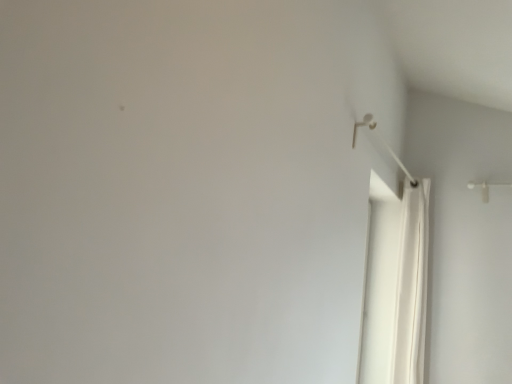
Question: Is white plastic shower at upper right positioned before white fabric shower curtain at right?

Choices:
 (A) no
 (B) yes

Answer: (B)

Question: From the image's perspective, does white plastic shower at upper right appear higher than white fabric shower curtain at right?

Choices:
 (A) no
 (B) yes

Answer: (B)

Question: From a real-world perspective, is white plastic shower at upper right under white fabric shower curtain at right?

Choices:
 (A) no
 (B) yes

Answer: (A)

Question: Is white plastic shower at upper right at the right side of white fabric shower curtain at right?

Choices:
 (A) yes
 (B) no

Answer: (B)

Question: Is white plastic shower at upper right aimed at white fabric shower curtain at right?

Choices:
 (A) no
 (B) yes

Answer: (A)

Question: Is white plastic shower at upper right directly adjacent to white fabric shower curtain at right?

Choices:
 (A) yes
 (B) no

Answer: (B)

Question: From the image's perspective, is white fabric shower curtain at right on top of white plastic shower at upper right?

Choices:
 (A) yes
 (B) no

Answer: (B)

Question: Can you confirm if white fabric shower curtain at right is taller than white plastic shower at upper right?

Choices:
 (A) no
 (B) yes

Answer: (B)

Question: Can you confirm if white fabric shower curtain at right is smaller than white plastic shower at upper right?

Choices:
 (A) yes
 (B) no

Answer: (B)

Question: Is white fabric shower curtain at right surrounding white plastic shower at upper right?

Choices:
 (A) no
 (B) yes

Answer: (A)

Question: Can you confirm if white fabric shower curtain at right is shorter than white plastic shower at upper right?

Choices:
 (A) no
 (B) yes

Answer: (A)

Question: Can you confirm if white fabric shower curtain at right is positioned to the left of white plastic shower at upper right?

Choices:
 (A) no
 (B) yes

Answer: (A)

Question: Based on their positions, is white fabric shower curtain at right located to the left or right of white plastic shower at upper right?

Choices:
 (A) left
 (B) right

Answer: (B)